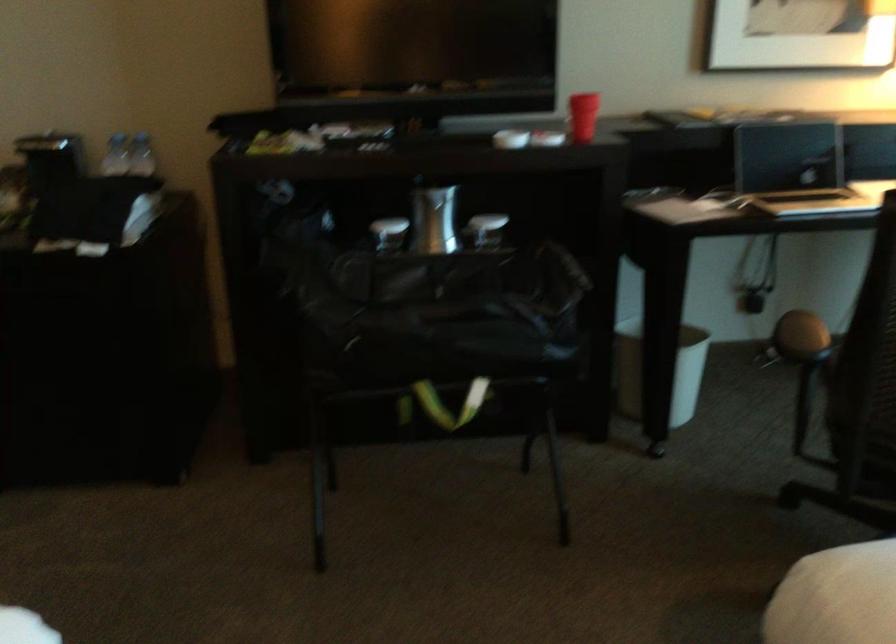
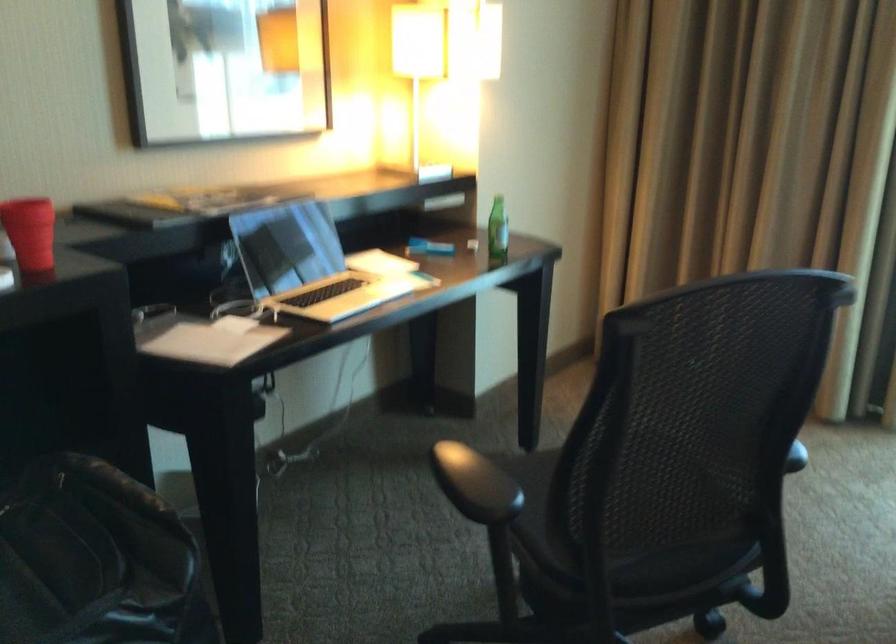
Question: The camera is either moving clockwise (left) or counter-clockwise (right) around the object. The first image is from the beginning of the video and the second image is from the end. Is the camera moving left or right when shooting the video?

Choices:
 (A) Left
 (B) Right

Answer: (A)